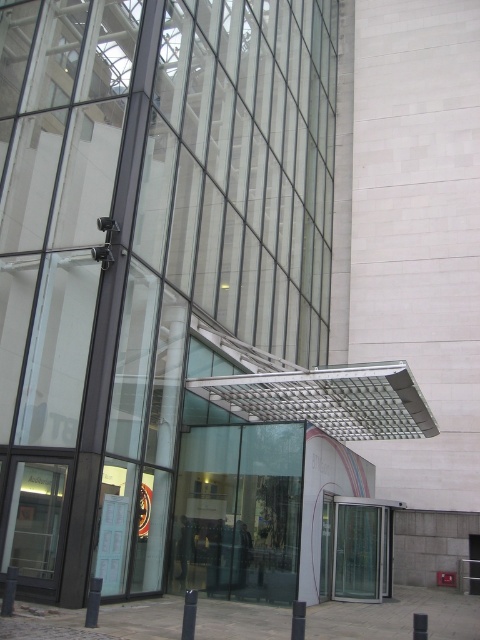
Does transparent glass door at center lie in front of transparent glass door at lower center?

Yes, it is in front of transparent glass door at lower center.

Which is behind, point (269, 584) or point (336, 552)?

Point (336, 552)

Between point (277, 532) and point (345, 518), which one is positioned in front?

Point (277, 532) is more forward.

You are a GUI agent. You are given a task and a screenshot of the screen. Output one action in this format:
    pyautogui.click(x=<x>, y=<y>)
    Task: Click on the transparent glass door at center
    This screenshot has width=480, height=640.
    Given the screenshot: What is the action you would take?
    point(239,513)